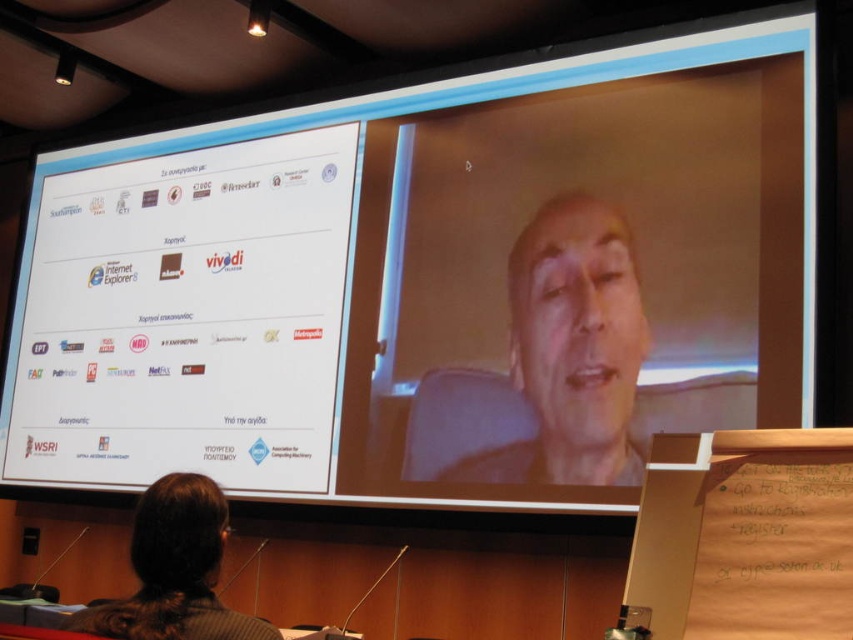
Looking at this image, in the presentation scene, there is a smooth skin face at center and a brown hair at lower left. Which object is positioned to the right of the other?

The smooth skin face at center is positioned to the right of brown hair at lower left.

You are attending a virtual meeting and see the screen described. Which object is closer to you, the smooth skin face at center or the brown hair at lower left?

The smooth skin face at center is closer to you than the brown hair at lower left.